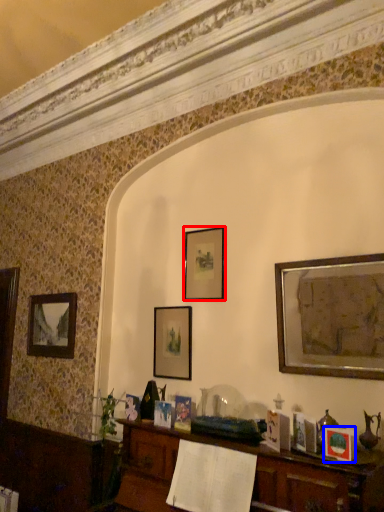
Question: Which object is further to the camera taking this photo, picture frame (highlighted by a red box) or picture frame (highlighted by a blue box)?

Choices:
 (A) picture frame
 (B) picture frame

Answer: (A)